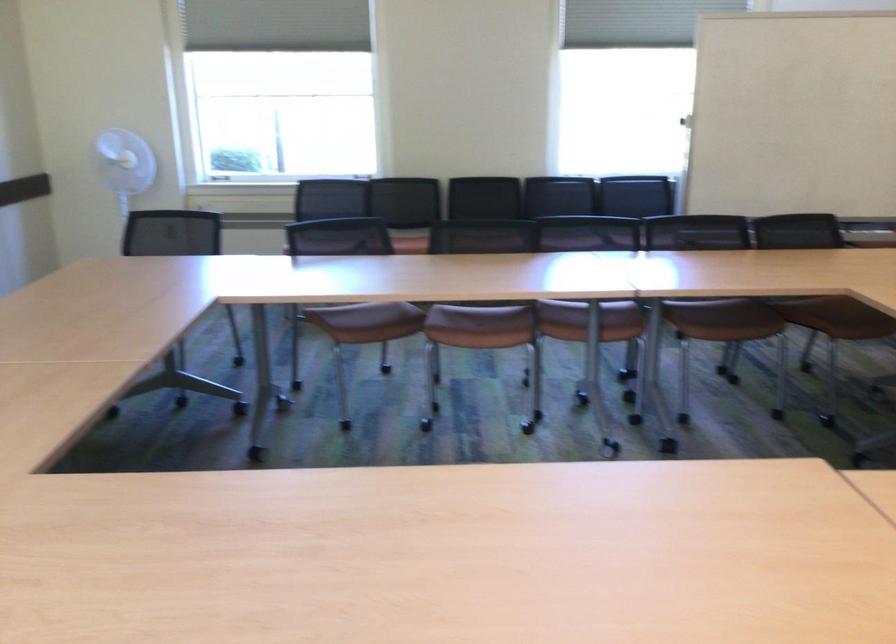
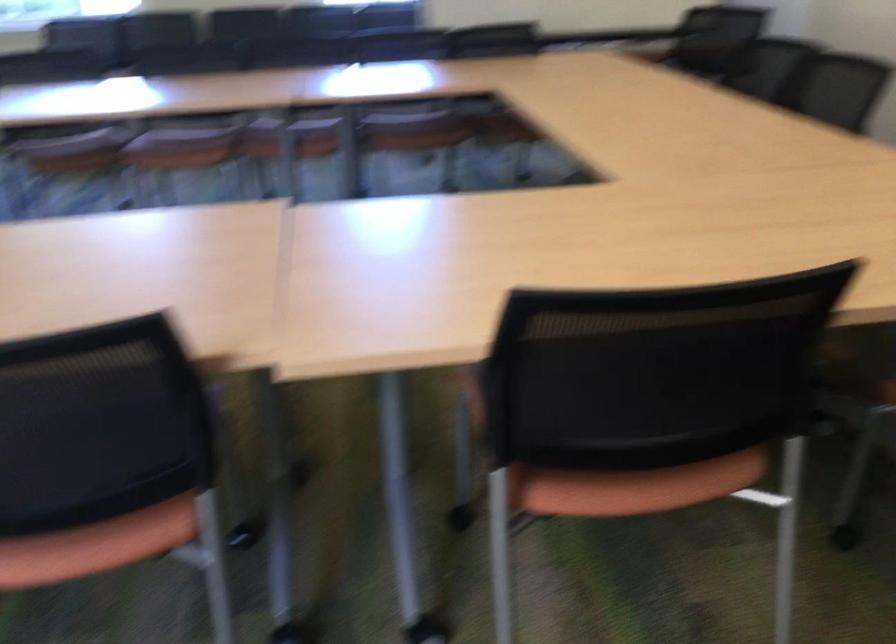
Question: How did the camera likely rotate?

Choices:
 (A) Left
 (B) Right
 (C) Up
 (D) Down

Answer: (D)